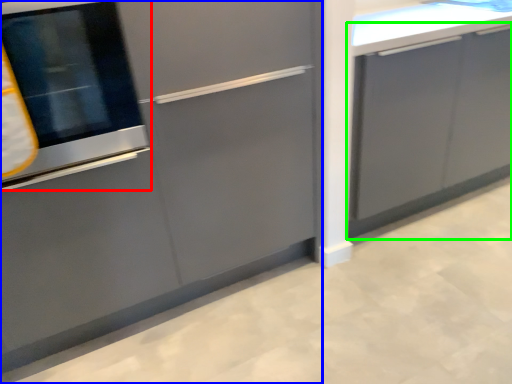
Question: Based on their relative distances, which object is farther from oven (highlighted by a red box)? Choose from cabinetry (highlighted by a blue box) and cabinetry (highlighted by a green box).

Choices:
 (A) cabinetry
 (B) cabinetry

Answer: (B)